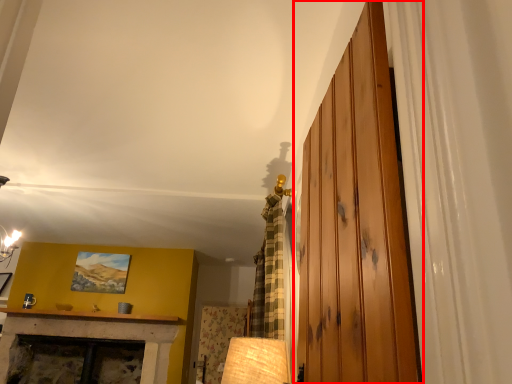
Question: Where is barn door (annotated by the red box) located in relation to picture frame in the image?

Choices:
 (A) left
 (B) right

Answer: (B)